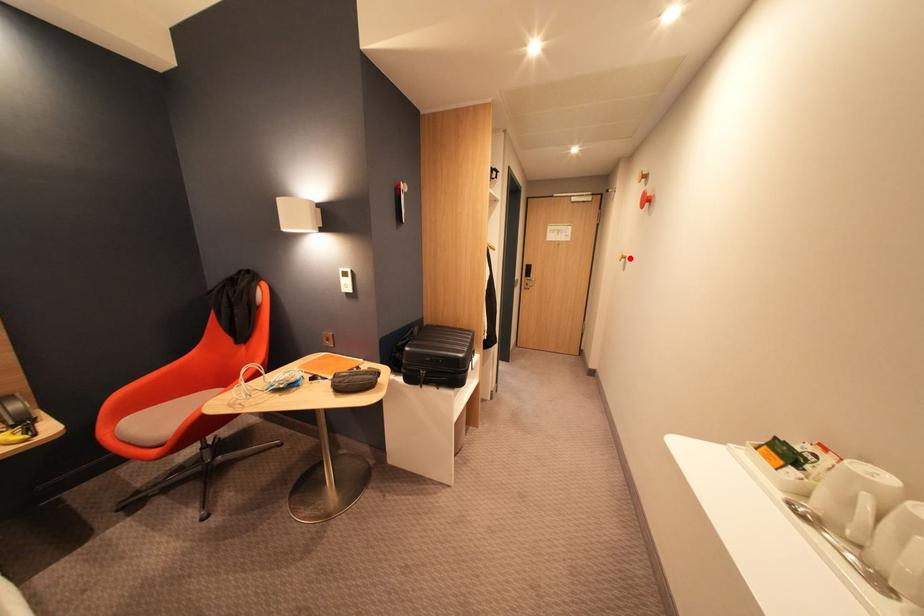
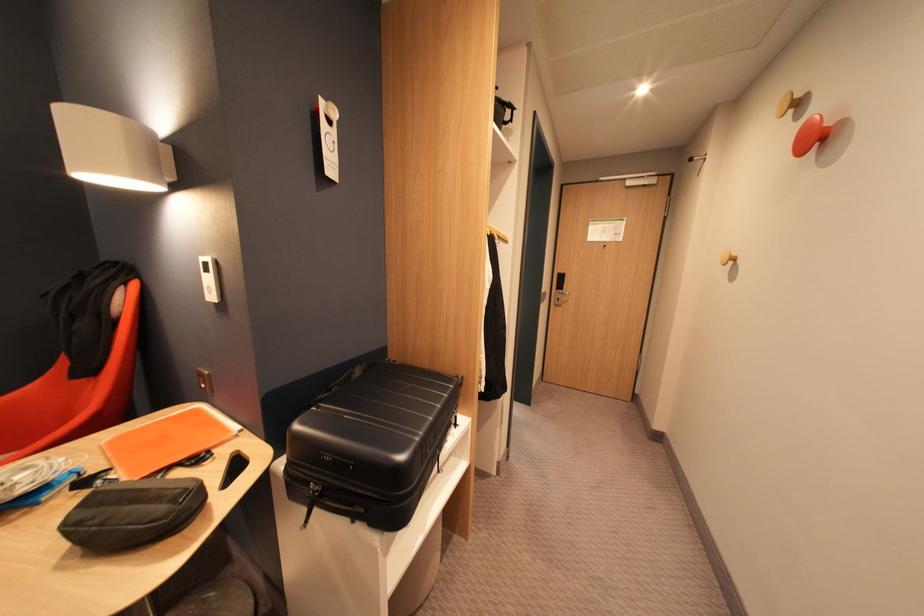
Find the pixel in the second image that matches the highlighted location in the first image.

(736, 259)